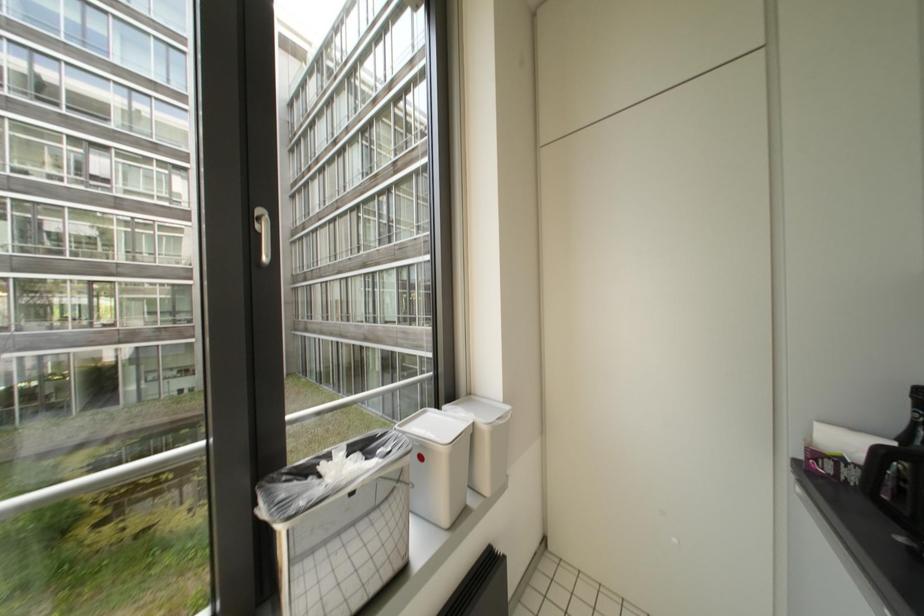
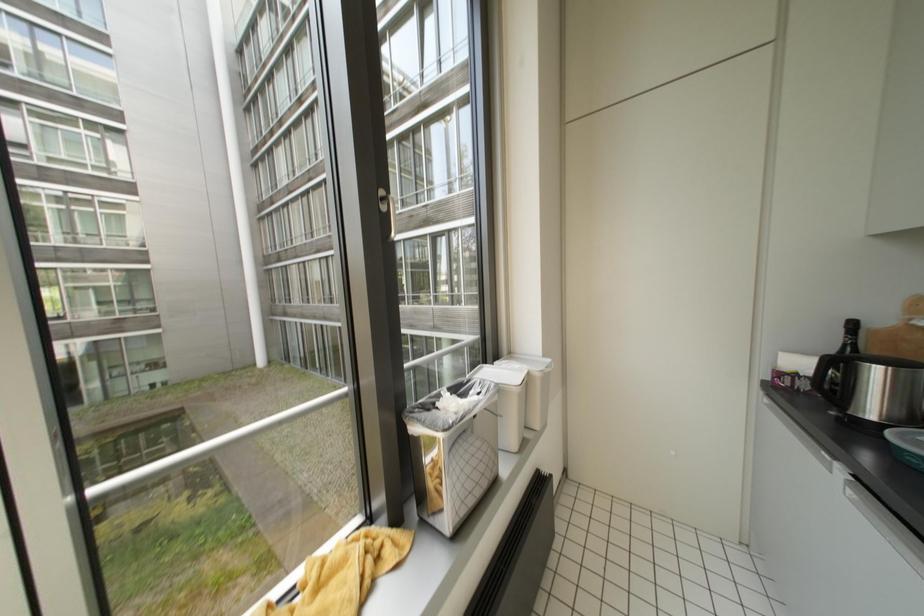
Question: In a continuous first-person perspective shot, in which direction is the camera moving?

Choices:
 (A) Left
 (B) Right
 (C) Forward
 (D) Backward

Answer: (A)